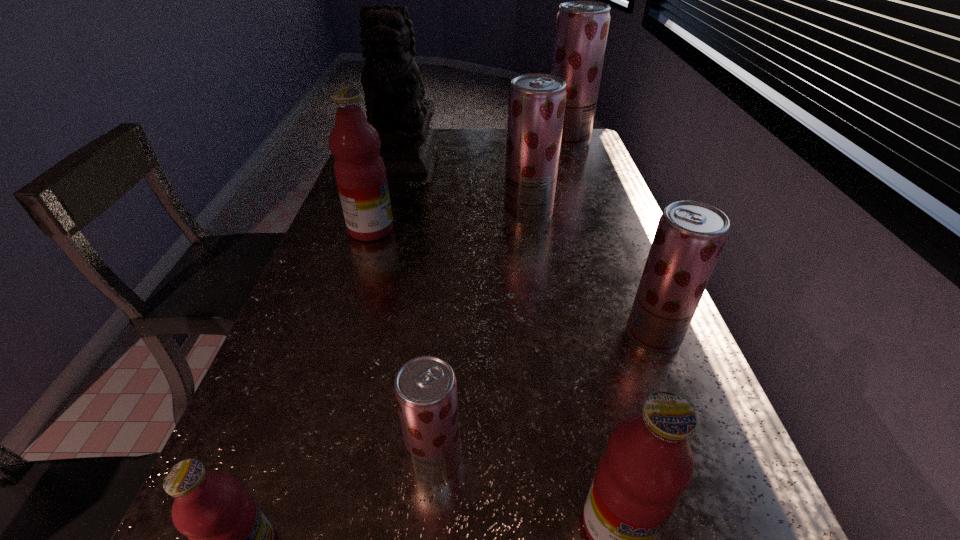
At what (x,y) coordinates should I click in order to perform the action: click on vacant space that satisfies the following two spatial constraints: 1. on the front-facing side of the sculpture; 2. on the right side of the smallest strawberry fruit juice. Please return your answer as a coordinate pair (x, y). Looking at the image, I should click on (318, 461).